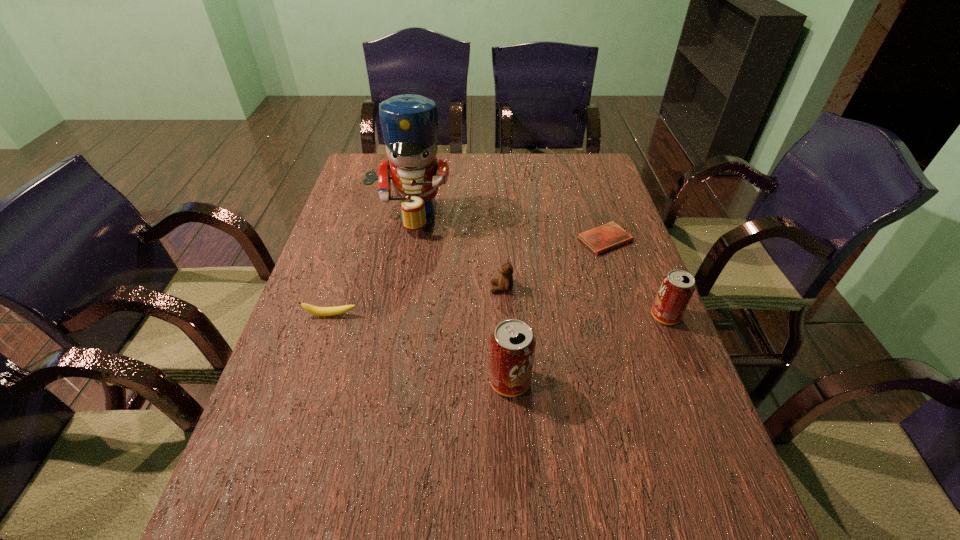
Locate an element on the screen. diary that is at the right edge is located at coordinates (600, 239).

This screenshot has width=960, height=540. In order to click on free region at the far edge of the desktop in this screenshot , I will do `click(448, 181)`.

Find the location of `vacant space at the left edge`. vacant space at the left edge is located at coordinates (361, 192).

The width and height of the screenshot is (960, 540). Identify the location of blank space at the right edge of the desktop. (599, 206).

Where is `free space at the far right corner`? Image resolution: width=960 pixels, height=540 pixels. free space at the far right corner is located at coordinates (570, 164).

Image resolution: width=960 pixels, height=540 pixels. Find the location of `free space between the shorter soda can and the third farthest object`. free space between the shorter soda can and the third farthest object is located at coordinates (584, 302).

Locate an element on the screen. The image size is (960, 540). vacant area between the shorter soda can and the second shortest object is located at coordinates (498, 315).

Find the location of `vacant space that's between the third shortest object and the fifth tallest object`. vacant space that's between the third shortest object and the fifth tallest object is located at coordinates (416, 301).

The height and width of the screenshot is (540, 960). Find the location of `vacant area that lies between the third farthest object and the fourth shortest object`. vacant area that lies between the third farthest object and the fourth shortest object is located at coordinates (584, 302).

Where is `vacant point located between the shortest object and the second shortest object`? vacant point located between the shortest object and the second shortest object is located at coordinates (468, 277).